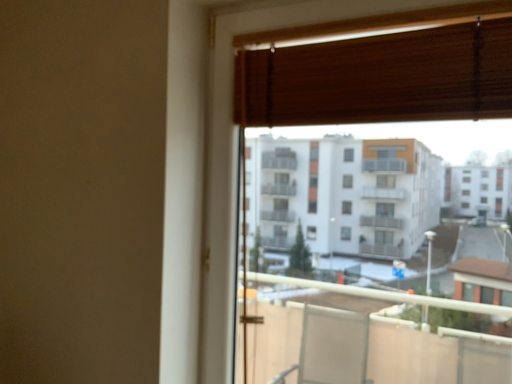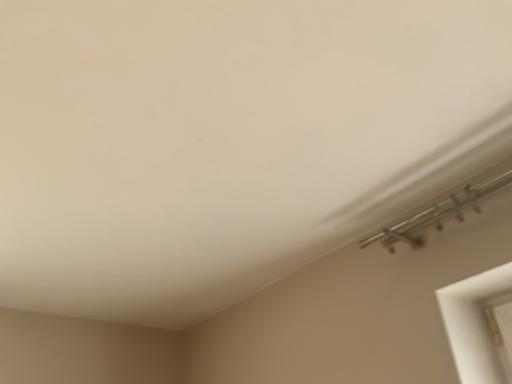
Question: How did the camera likely rotate when shooting the video?

Choices:
 (A) rotated right
 (B) rotated left

Answer: (B)